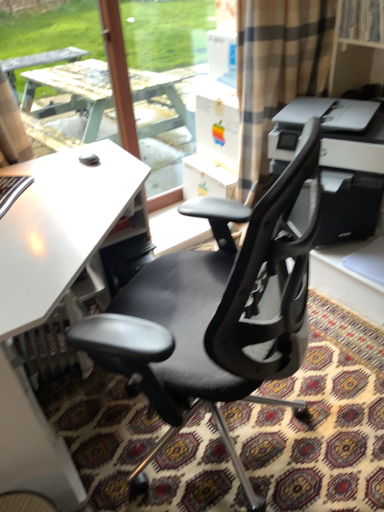
Question: Considering the positions of black mesh office chair at center and white matte desk at center in the image, is black mesh office chair at center wider or thinner than white matte desk at center?

Choices:
 (A) wide
 (B) thin

Answer: (B)

Question: From their relative heights in the image, would you say black mesh office chair at center is taller or shorter than white matte desk at center?

Choices:
 (A) tall
 (B) short

Answer: (A)

Question: Based on their relative distances, which object is farther from the black mesh office chair at center?

Choices:
 (A) white matte desk at center
 (B) white plastic printer at upper right

Answer: (B)

Question: Which of these objects is positioned closest to the white plastic printer at upper right?

Choices:
 (A) white matte desk at center
 (B) black mesh office chair at center

Answer: (B)